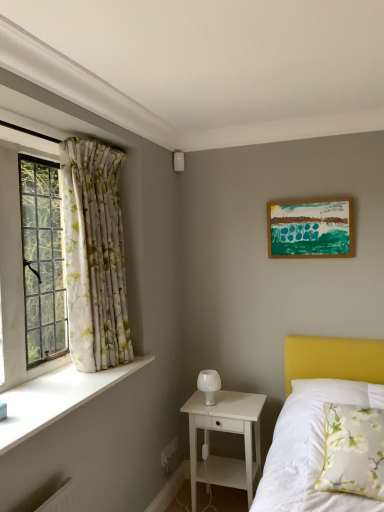
Where is `free space above floral fabric curtain at left (from a real-world perspective)`? The image size is (384, 512). free space above floral fabric curtain at left (from a real-world perspective) is located at coordinates (98, 140).